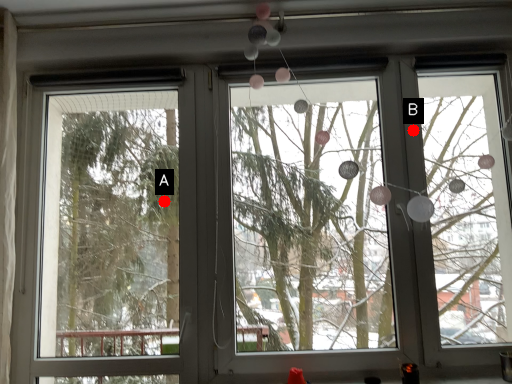
Question: Two points are circled on the image, labeled by A and B beside each circle. Which point is closer to the camera taking this photo?

Choices:
 (A) A is closer
 (B) B is closer

Answer: (B)